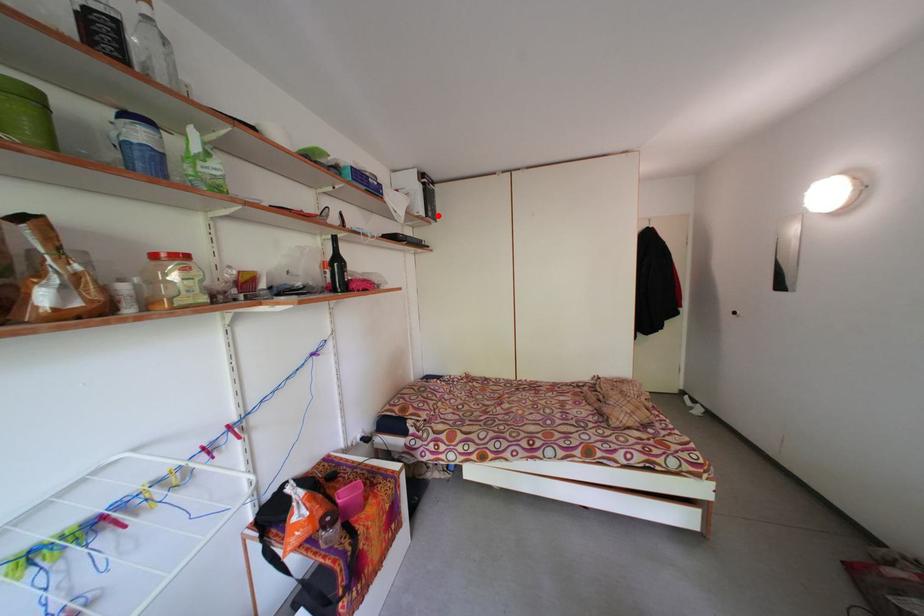
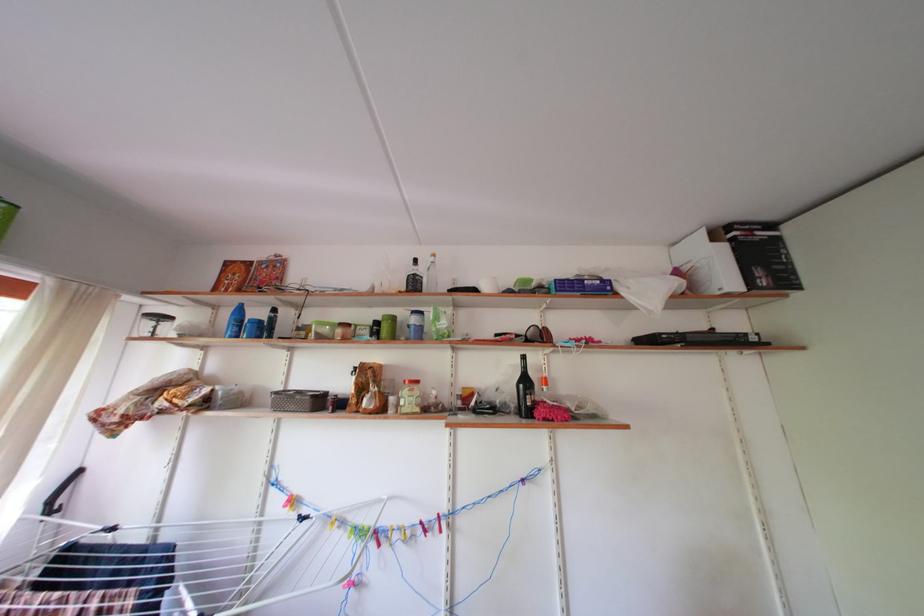
Locate, in the second image, the point that corresponds to the highlighted location in the first image.

(768, 278)